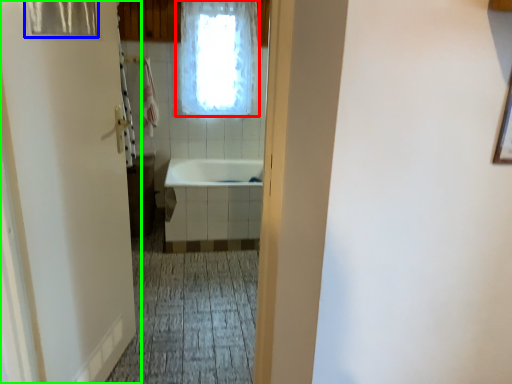
Question: Which object is the farthest from window (highlighted by a red box)? Choose among these: shower curtain (highlighted by a blue box) or door (highlighted by a green box).

Choices:
 (A) shower curtain
 (B) door

Answer: (A)